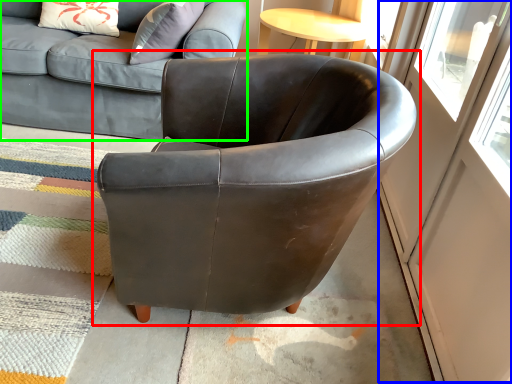
Question: Which object is the farthest from chair (highlighted by a red box)? Choose among these: screen door (highlighted by a blue box) or studio couch (highlighted by a green box).

Choices:
 (A) screen door
 (B) studio couch

Answer: (B)